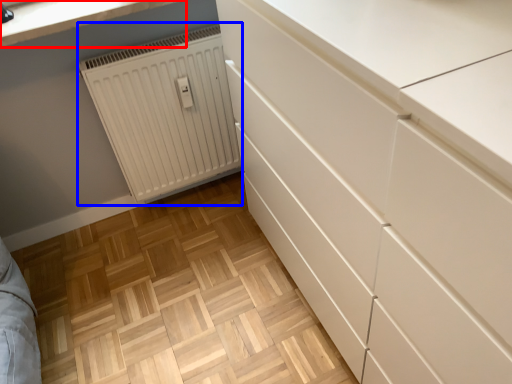
Question: Among these objects, which one is nearest to the camera, countertop (highlighted by a red box) or radiator (highlighted by a blue box)?

Choices:
 (A) countertop
 (B) radiator

Answer: (A)